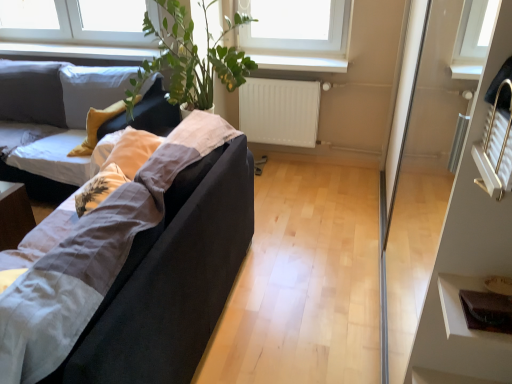
Question: Is matte black couch at left, marked as the first studio couch in a back-to-front arrangement, shorter than brown leather wallet at lower right?

Choices:
 (A) no
 (B) yes

Answer: (A)

Question: From the image's perspective, is matte black couch at left, the 2th studio couch when ordered from front to back, over brown leather wallet at lower right?

Choices:
 (A) yes
 (B) no

Answer: (A)

Question: Could you tell me if matte black couch at left, marked as the first studio couch in a back-to-front arrangement, is turned towards brown leather wallet at lower right?

Choices:
 (A) yes
 (B) no

Answer: (B)

Question: Does matte black couch at left, the 2th studio couch when ordered from front to back, lie behind brown leather wallet at lower right?

Choices:
 (A) no
 (B) yes

Answer: (B)

Question: Does matte black couch at left, the 2th studio couch when ordered from front to back, have a larger size compared to brown leather wallet at lower right?

Choices:
 (A) no
 (B) yes

Answer: (B)

Question: Is point (301, 109) positioned closer to the camera than point (15, 109)?

Choices:
 (A) farther
 (B) closer

Answer: (A)

Question: Is white matte radiator at center bigger or smaller than matte black couch at left, marked as the first studio couch in a back-to-front arrangement?

Choices:
 (A) small
 (B) big

Answer: (A)

Question: Is white matte radiator at center in front of or behind matte black couch at left, the 2th studio couch when ordered from front to back, in the image?

Choices:
 (A) front
 (B) behind

Answer: (B)

Question: Which is correct: white matte radiator at center is inside matte black couch at left, the 2th studio couch when ordered from front to back, or outside of it?

Choices:
 (A) outside
 (B) inside

Answer: (A)

Question: Considering their positions, is white matte radiator at center located in front of or behind brown leather wallet at lower right?

Choices:
 (A) behind
 (B) front

Answer: (A)

Question: In the image, is white matte radiator at center on the left side or the right side of brown leather wallet at lower right?

Choices:
 (A) right
 (B) left

Answer: (B)

Question: Is white matte radiator at center inside or outside of brown leather wallet at lower right?

Choices:
 (A) inside
 (B) outside

Answer: (B)

Question: In terms of size, does white matte radiator at center appear bigger or smaller than brown leather wallet at lower right?

Choices:
 (A) big
 (B) small

Answer: (A)

Question: Considering the positions of point (465, 283) and point (310, 59), is point (465, 283) closer or farther from the camera than point (310, 59)?

Choices:
 (A) farther
 (B) closer

Answer: (B)

Question: Is brown leather wallet at lower right to the left or to the right of white plastic window sill at upper center in the image?

Choices:
 (A) left
 (B) right

Answer: (B)